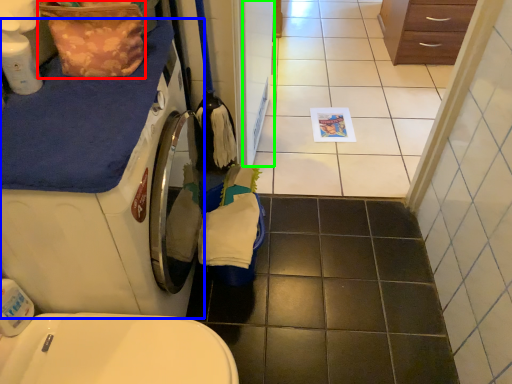
Question: Which is nearer to the material (highlighted by a red box)? washing machine (highlighted by a blue box) or screen door (highlighted by a green box).

Choices:
 (A) washing machine
 (B) screen door

Answer: (A)